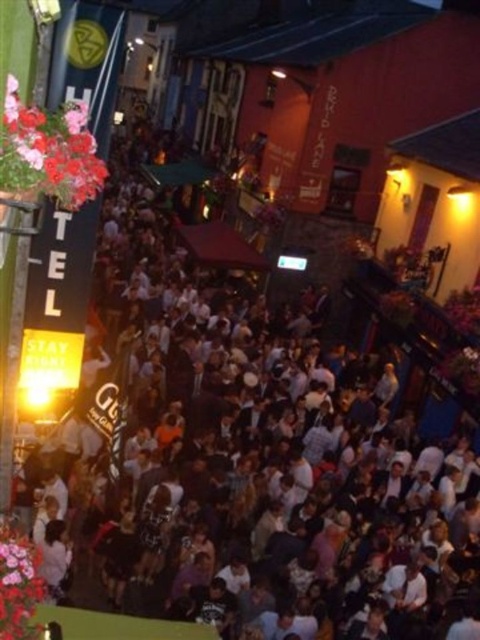
Who is shorter, matte pink flowers at upper left or pink floral bouquet at lower left?

Standing shorter between the two is matte pink flowers at upper left.

Looking at this image, can you confirm if matte pink flowers at upper left is thinner than pink floral bouquet at lower left?

Yes.

The image size is (480, 640). Find the location of `matte pink flowers at upper left`. matte pink flowers at upper left is located at coordinates (48, 150).

The width and height of the screenshot is (480, 640). Identify the location of matte pink flowers at upper left. (48, 150).